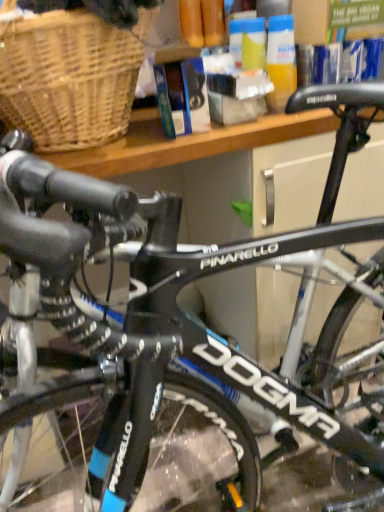
Question: Should I look upward or downward to see woven wicker basket at upper left?

Choices:
 (A) up
 (B) down

Answer: (A)